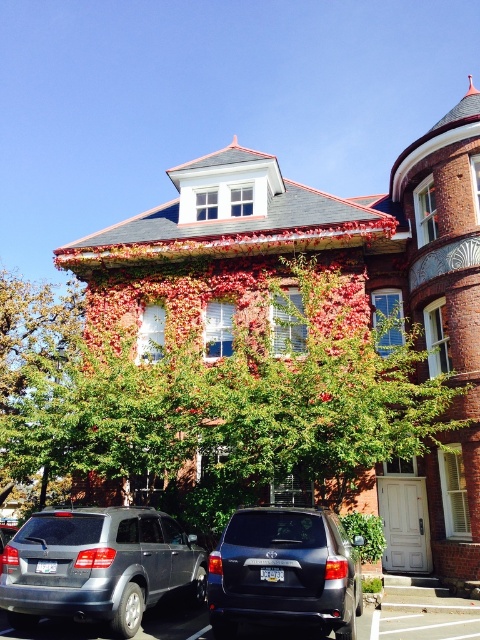
Between green leafy tree at center and matte black suv at center, which one appears on the right side from the viewer's perspective?

matte black suv at center

Describe the element at coordinates (237, 404) in the screenshot. The height and width of the screenshot is (640, 480). I see `green leafy tree at center` at that location.

Find the location of a particular element. green leafy tree at center is located at coordinates (237, 404).

Measure the distance between satin gray suv at lower left and matte black suv at center.

2.51 meters

Can you confirm if satin gray suv at lower left is smaller than matte black suv at center?

Incorrect, satin gray suv at lower left is not smaller in size than matte black suv at center.

At what (x,y) coordinates should I click in order to perform the action: click on satin gray suv at lower left. Please return your answer as a coordinate pair (x, y). The image size is (480, 640). Looking at the image, I should click on (98, 566).

Measure the distance from green leafy tree at center to satin gray suv at lower left.

green leafy tree at center and satin gray suv at lower left are 17.04 feet apart.

Who is more distant from viewer, (x=24, y=413) or (x=33, y=545)?

The point (x=24, y=413) is more distant.

Is point (136, 387) farther from camera compared to point (26, 570)?

Yes, point (136, 387) is behind point (26, 570).

What are the coordinates of `green leafy tree at center` in the screenshot? It's located at (237, 404).